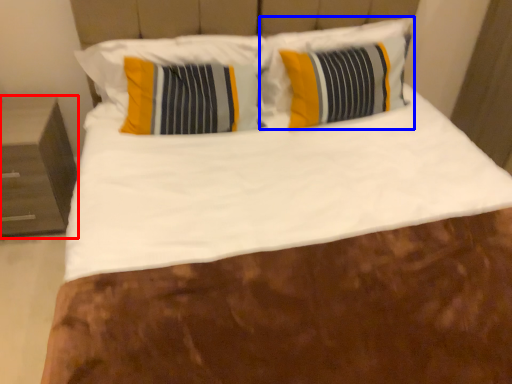
Question: Which object appears farthest to the camera in this image, nightstand (highlighted by a red box) or pillow (highlighted by a blue box)?

Choices:
 (A) nightstand
 (B) pillow

Answer: (B)